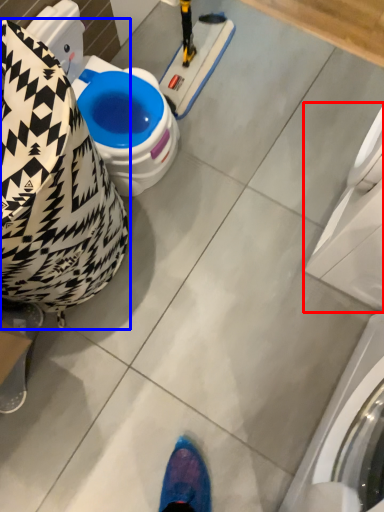
Question: Which object is further to the camera taking this photo, washing machine (highlighted by a red box) or bean bag chair (highlighted by a blue box)?

Choices:
 (A) washing machine
 (B) bean bag chair

Answer: (B)